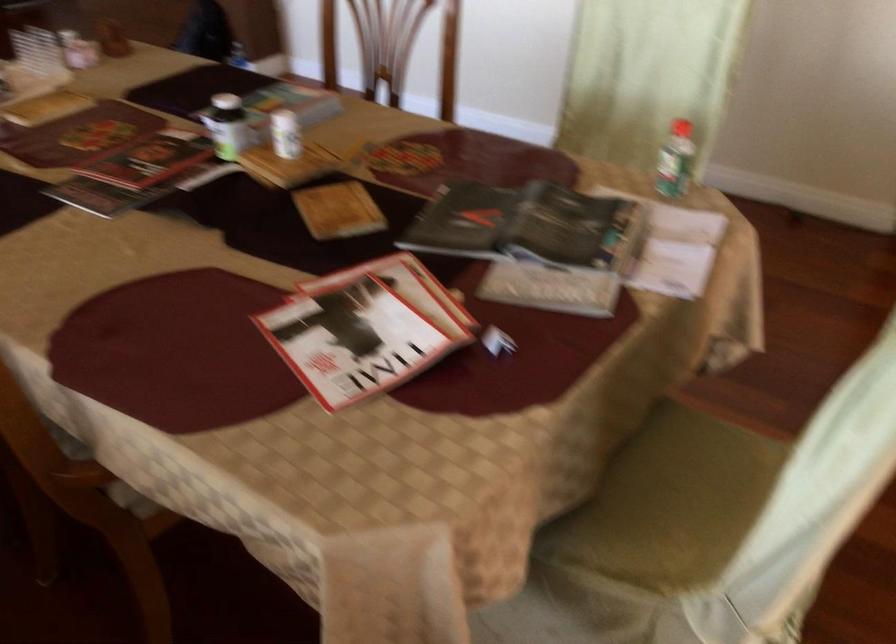
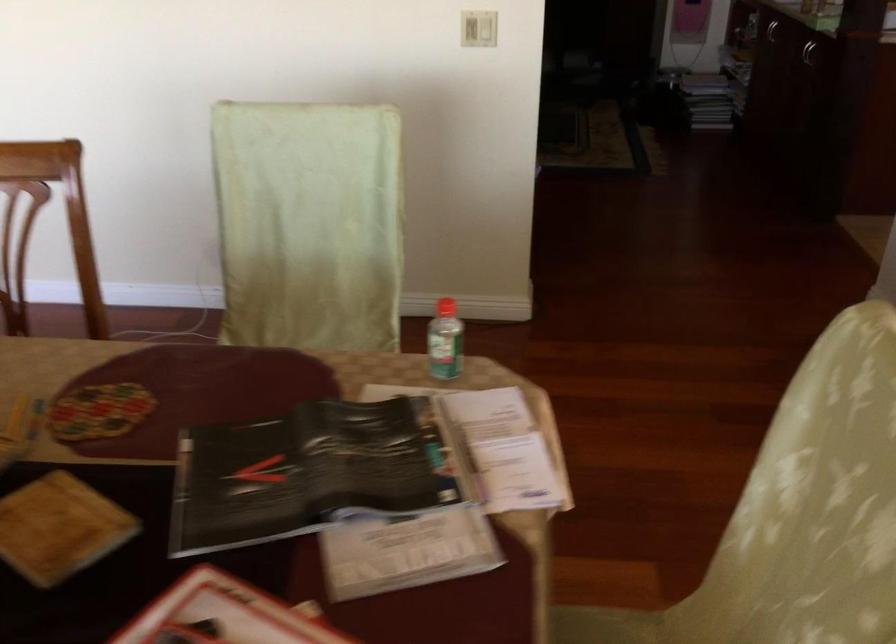
The point at (668, 156) is marked in the first image. Where is the corresponding point in the second image?

(444, 341)